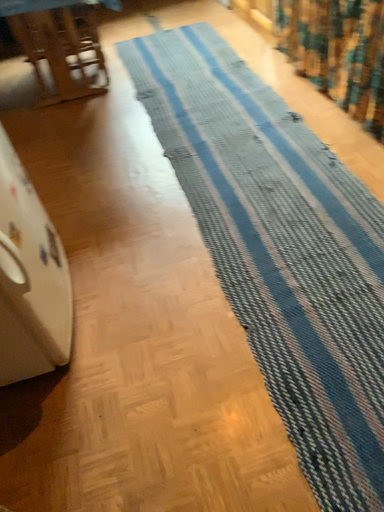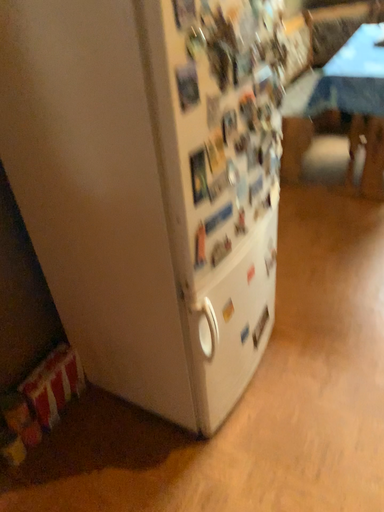
Question: Which way did the camera rotate in the video?

Choices:
 (A) rotated downward
 (B) rotated upward

Answer: (B)